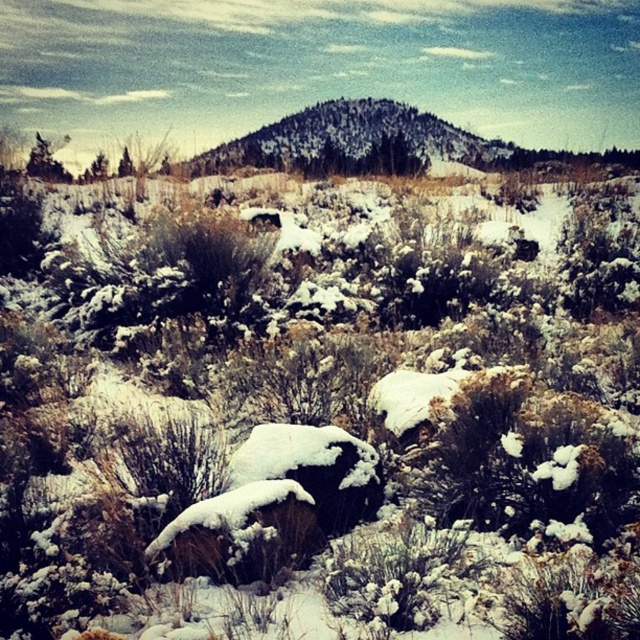
Question: Which is farther from the green textured hill at center?

Choices:
 (A) green textured bush at upper left
 (B) snow-covered rock at center

Answer: (B)

Question: Can you confirm if green textured hill at center is thinner than snow-covered rock at center?

Choices:
 (A) no
 (B) yes

Answer: (A)

Question: Considering the real-world distances, which object is closest to the green textured hill at center?

Choices:
 (A) green textured bush at upper left
 (B) snow-covered rock at center

Answer: (A)

Question: Among these points, which one is farthest from the camera?

Choices:
 (A) (28, 154)
 (B) (392, 129)
 (C) (273, 458)

Answer: (B)

Question: Does green textured hill at center have a smaller size compared to green textured bush at upper left?

Choices:
 (A) no
 (B) yes

Answer: (A)

Question: Can you confirm if snow-covered rock at center is thinner than green textured bush at upper left?

Choices:
 (A) yes
 (B) no

Answer: (A)